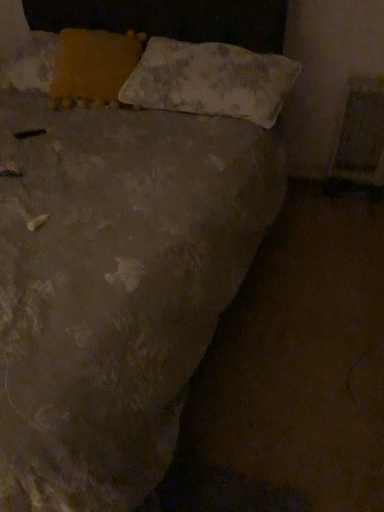
At what (x,y) coordinates should I click in order to perform the action: click on yellow fabric pillow at upper left, the second pillow from the right. Please return your answer as a coordinate pair (x, y). This screenshot has width=384, height=512. Looking at the image, I should click on (92, 67).

What do you see at coordinates (92, 67) in the screenshot? This screenshot has width=384, height=512. I see `yellow fabric pillow at upper left, the second pillow from the right` at bounding box center [92, 67].

Locate an element on the screen. The image size is (384, 512). faded fabric pillow at upper center, placed as the first pillow when sorted from right to left is located at coordinates (210, 80).

This screenshot has height=512, width=384. What do you see at coordinates (210, 80) in the screenshot?
I see `faded fabric pillow at upper center, placed as the second pillow when sorted from left to right` at bounding box center [210, 80].

At what (x,y) coordinates should I click in order to perform the action: click on yellow fabric pillow at upper left, the 1th pillow positioned from the left. Please return your answer as a coordinate pair (x, y). The width and height of the screenshot is (384, 512). Looking at the image, I should click on (92, 67).

From the picture: Visually, is faded fabric pillow at upper center, placed as the first pillow when sorted from right to left, positioned to the left or to the right of yellow fabric pillow at upper left, the 1th pillow positioned from the left?

faded fabric pillow at upper center, placed as the first pillow when sorted from right to left, is positioned on yellow fabric pillow at upper left, the 1th pillow positioned from the left,'s right side.

Considering the relative positions of faded fabric pillow at upper center, placed as the first pillow when sorted from right to left, and yellow fabric pillow at upper left, the second pillow from the right, in the image provided, is faded fabric pillow at upper center, placed as the first pillow when sorted from right to left, in front of yellow fabric pillow at upper left, the second pillow from the right,?

Yes.

Considering the points (147, 92) and (80, 55), which point is behind, point (147, 92) or point (80, 55)?

The point (80, 55) is farther.

From the image's perspective, is faded fabric pillow at upper center, placed as the second pillow when sorted from left to right, under yellow fabric pillow at upper left, the second pillow from the right?

Indeed, from the image's perspective, faded fabric pillow at upper center, placed as the second pillow when sorted from left to right, is shown beneath yellow fabric pillow at upper left, the second pillow from the right.

From a real-world perspective, is faded fabric pillow at upper center, placed as the second pillow when sorted from left to right, physically located above or below yellow fabric pillow at upper left, the second pillow from the right?

faded fabric pillow at upper center, placed as the second pillow when sorted from left to right, is below yellow fabric pillow at upper left, the second pillow from the right.

In terms of width, does faded fabric pillow at upper center, placed as the first pillow when sorted from right to left, look wider or thinner when compared to yellow fabric pillow at upper left, the second pillow from the right?

In the image, faded fabric pillow at upper center, placed as the first pillow when sorted from right to left, appears to be wider than yellow fabric pillow at upper left, the second pillow from the right.

Based on the photo, is faded fabric pillow at upper center, placed as the second pillow when sorted from left to right, shorter than yellow fabric pillow at upper left, the 1th pillow positioned from the left?

Indeed, faded fabric pillow at upper center, placed as the second pillow when sorted from left to right, has a lesser height compared to yellow fabric pillow at upper left, the 1th pillow positioned from the left.

Which of these two, faded fabric pillow at upper center, placed as the second pillow when sorted from left to right, or yellow fabric pillow at upper left, the second pillow from the right, is smaller?

With smaller size is yellow fabric pillow at upper left, the second pillow from the right.

Can yellow fabric pillow at upper left, the 1th pillow positioned from the left, be found inside faded fabric pillow at upper center, placed as the second pillow when sorted from left to right?

No, yellow fabric pillow at upper left, the 1th pillow positioned from the left, is located outside of faded fabric pillow at upper center, placed as the second pillow when sorted from left to right.

Is faded fabric pillow at upper center, placed as the first pillow when sorted from right to left, touching yellow fabric pillow at upper left, the second pillow from the right?

No, faded fabric pillow at upper center, placed as the first pillow when sorted from right to left, is not next to yellow fabric pillow at upper left, the second pillow from the right.

Could you tell me if faded fabric pillow at upper center, placed as the first pillow when sorted from right to left, is turned towards yellow fabric pillow at upper left, the second pillow from the right?

No, faded fabric pillow at upper center, placed as the first pillow when sorted from right to left, is not oriented towards yellow fabric pillow at upper left, the second pillow from the right.

How many degrees apart are the facing directions of faded fabric pillow at upper center, placed as the second pillow when sorted from left to right, and yellow fabric pillow at upper left, the 1th pillow positioned from the left?

18.1 degrees.

The width and height of the screenshot is (384, 512). In order to click on pillow above the faded fabric pillow at upper center, placed as the first pillow when sorted from right to left (from a real-world perspective) in this screenshot , I will do `click(92, 67)`.

Consider the image. Considering the relative positions of yellow fabric pillow at upper left, the 1th pillow positioned from the left, and faded fabric pillow at upper center, placed as the second pillow when sorted from left to right, in the image provided, is yellow fabric pillow at upper left, the 1th pillow positioned from the left, to the right of faded fabric pillow at upper center, placed as the second pillow when sorted from left to right, from the viewer's perspective?

In fact, yellow fabric pillow at upper left, the 1th pillow positioned from the left, is to the left of faded fabric pillow at upper center, placed as the second pillow when sorted from left to right.

Is yellow fabric pillow at upper left, the second pillow from the right, positioned before faded fabric pillow at upper center, placed as the first pillow when sorted from right to left?

No, yellow fabric pillow at upper left, the second pillow from the right, is further to the viewer.

Is point (82, 100) farther from viewer compared to point (248, 117)?

Yes, point (82, 100) is behind point (248, 117).

From the image's perspective, is yellow fabric pillow at upper left, the second pillow from the right, positioned above or below faded fabric pillow at upper center, placed as the first pillow when sorted from right to left?

yellow fabric pillow at upper left, the second pillow from the right, is situated higher than faded fabric pillow at upper center, placed as the first pillow when sorted from right to left, in the image.

From a real-world perspective, is yellow fabric pillow at upper left, the 1th pillow positioned from the left, physically located above or below faded fabric pillow at upper center, placed as the second pillow when sorted from left to right?

From a real-world perspective, yellow fabric pillow at upper left, the 1th pillow positioned from the left, is physically above faded fabric pillow at upper center, placed as the second pillow when sorted from left to right.

Can you confirm if yellow fabric pillow at upper left, the second pillow from the right, is thinner than faded fabric pillow at upper center, placed as the first pillow when sorted from right to left?

Correct, the width of yellow fabric pillow at upper left, the second pillow from the right, is less than that of faded fabric pillow at upper center, placed as the first pillow when sorted from right to left.

Does yellow fabric pillow at upper left, the second pillow from the right, have a lesser height compared to faded fabric pillow at upper center, placed as the second pillow when sorted from left to right?

No.

Who is smaller, yellow fabric pillow at upper left, the second pillow from the right, or faded fabric pillow at upper center, placed as the first pillow when sorted from right to left?

yellow fabric pillow at upper left, the second pillow from the right, is smaller.

Is faded fabric pillow at upper center, placed as the second pillow when sorted from left to right, inside yellow fabric pillow at upper left, the second pillow from the right?

Definitely not — faded fabric pillow at upper center, placed as the second pillow when sorted from left to right, is not inside yellow fabric pillow at upper left, the second pillow from the right.

Is yellow fabric pillow at upper left, the 1th pillow positioned from the left, with faded fabric pillow at upper center, placed as the second pillow when sorted from left to right?

No, yellow fabric pillow at upper left, the 1th pillow positioned from the left, is not in contact with faded fabric pillow at upper center, placed as the second pillow when sorted from left to right.

Does yellow fabric pillow at upper left, the 1th pillow positioned from the left, turn towards faded fabric pillow at upper center, placed as the second pillow when sorted from left to right?

No, yellow fabric pillow at upper left, the 1th pillow positioned from the left, is not turned towards faded fabric pillow at upper center, placed as the second pillow when sorted from left to right.

Can you tell me how much yellow fabric pillow at upper left, the 1th pillow positioned from the left, and faded fabric pillow at upper center, placed as the second pillow when sorted from left to right, differ in facing direction?

There is a 18.1-degree angle between the facing directions of yellow fabric pillow at upper left, the 1th pillow positioned from the left, and faded fabric pillow at upper center, placed as the second pillow when sorted from left to right.

At what (x,y) coordinates should I click in order to perform the action: click on pillow on the right side of yellow fabric pillow at upper left, the second pillow from the right. Please return your answer as a coordinate pair (x, y). The width and height of the screenshot is (384, 512). Looking at the image, I should click on (210, 80).

In the image, there is a faded fabric pillow at upper center, placed as the first pillow when sorted from right to left. Where is `pillow above it (from the image's perspective)`? The image size is (384, 512). pillow above it (from the image's perspective) is located at coordinates (92, 67).

Where is `pillow on the left of faded fabric pillow at upper center, placed as the second pillow when sorted from left to right`? pillow on the left of faded fabric pillow at upper center, placed as the second pillow when sorted from left to right is located at coordinates (92, 67).